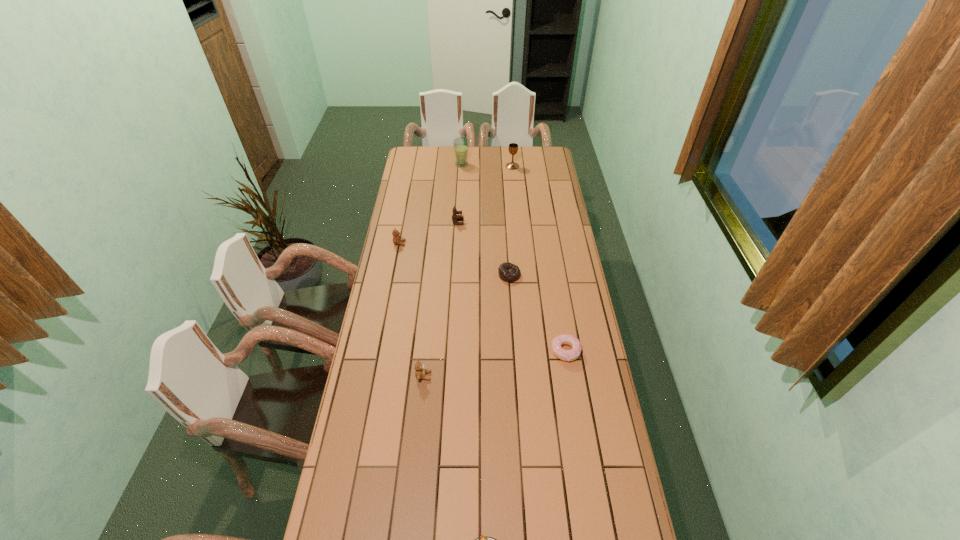
Identify the location of glass. The image size is (960, 540). (461, 144).

Find the location of `chalice`. chalice is located at coordinates (513, 147).

Where is `the farthest teddy bear`? the farthest teddy bear is located at coordinates (455, 217).

Find the location of a particular element. The width and height of the screenshot is (960, 540). the sixth nearest object is located at coordinates (455, 217).

What are the coordinates of `the leftmost teddy bear` in the screenshot? It's located at (397, 240).

Where is `the leftmost object`? the leftmost object is located at coordinates (397, 240).

I want to click on the nearest teddy bear, so click(420, 372).

What are the coordinates of `the second nearest object` in the screenshot? It's located at (420, 372).

Locate an element on the screen. The width and height of the screenshot is (960, 540). the fifth farthest object is located at coordinates (508, 272).

This screenshot has height=540, width=960. In order to click on the rightmost object in this screenshot , I will do `click(566, 355)`.